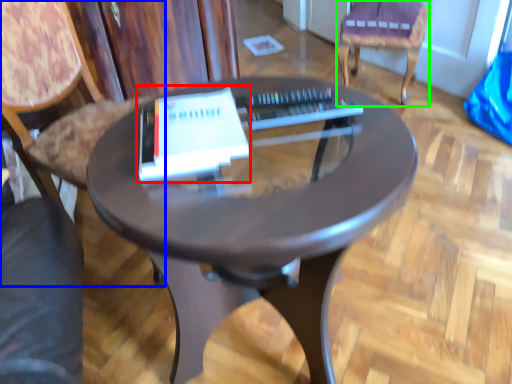
Question: Which is nearer to the paperback book (highlighted by a red box)? chair (highlighted by a blue box) or chair (highlighted by a green box).

Choices:
 (A) chair
 (B) chair

Answer: (A)